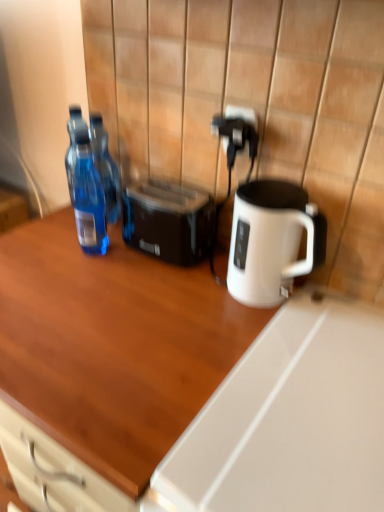
In order to click on vacant area in front of transparent plastic bottle at left, which ranks as the first bottle in back-to-front order in this screenshot , I will do `click(82, 252)`.